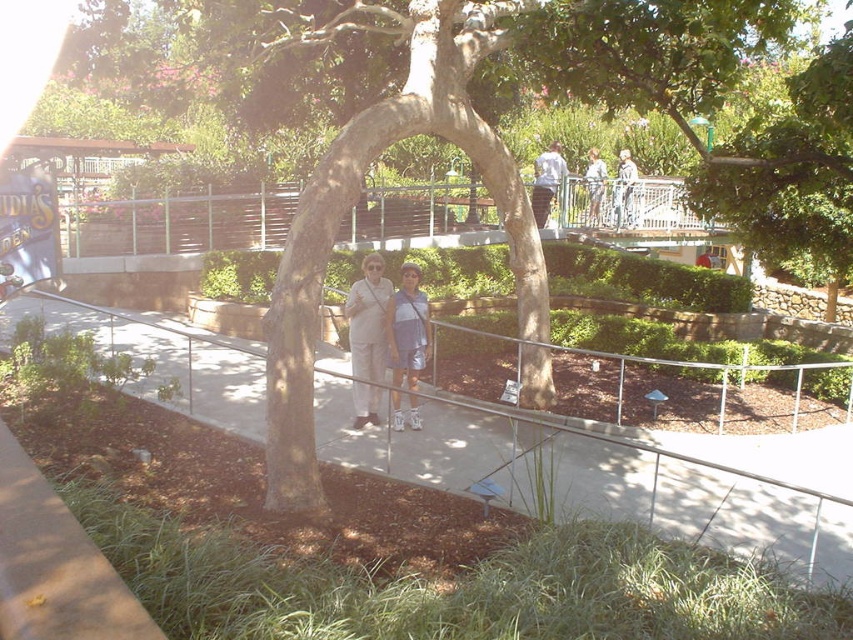
Is green textured tree at center positioned before light blue denim shorts at center?

Yes, it is in front of light blue denim shorts at center.

What are the coordinates of `green textured tree at center` in the screenshot? It's located at (444, 108).

Is point (572, 451) less distant than point (831, 124)?

That is False.

Can you confirm if smooth concrete path at center is positioned below green leafy tree at upper center?

Yes.

The height and width of the screenshot is (640, 853). Describe the element at coordinates (605, 476) in the screenshot. I see `smooth concrete path at center` at that location.

Locate an element on the screen. smooth concrete path at center is located at coordinates (605, 476).

Which is below, metallic silver railing at upper center or white cotton shirt at upper center?

Positioned lower is metallic silver railing at upper center.

Who is positioned more to the left, metallic silver railing at upper center or white cotton shirt at upper center?

white cotton shirt at upper center

What do you see at coordinates (178, 224) in the screenshot?
I see `metallic silver railing at upper center` at bounding box center [178, 224].

This screenshot has height=640, width=853. Identify the location of metallic silver railing at upper center. tap(178, 224).